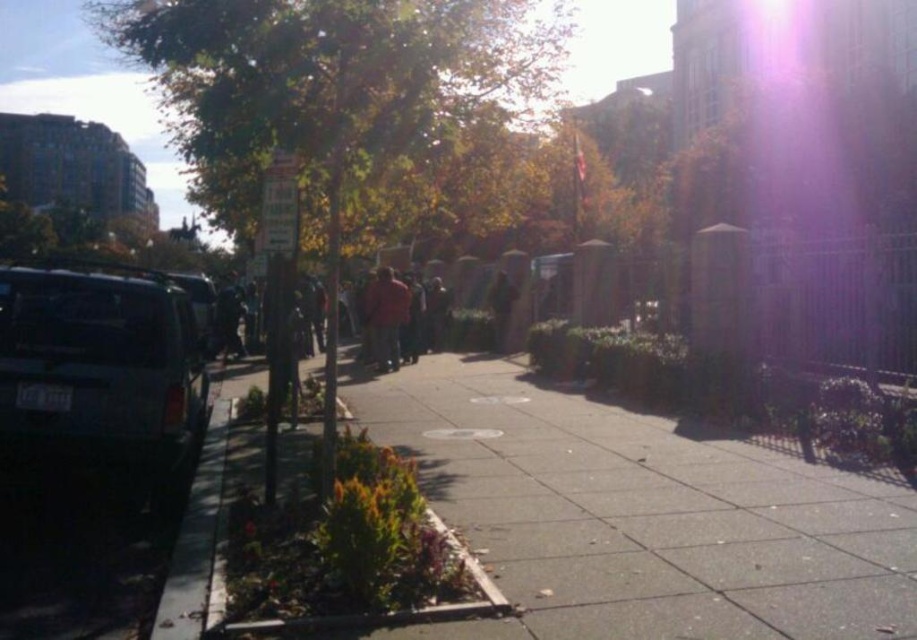
Question: Which object is closer to the camera taking this photo?

Choices:
 (A) black rubber curb at lower left
 (B) green leafy tree at left

Answer: (A)

Question: Which point is farther to the camera?

Choices:
 (A) black rubber curb at lower left
 (B) gray concrete sidewalk at center
 (C) dark gray matte van at left
 (D) matte black suv at left

Answer: (D)

Question: Which of the following is the farthest from the observer?

Choices:
 (A) (199, 321)
 (B) (685, 563)
 (C) (453, 124)
 (D) (396, 364)

Answer: (A)

Question: Is green leafy tree at left below black rubber curb at lower left?

Choices:
 (A) yes
 (B) no

Answer: (B)

Question: Is green leafy tree at left bigger than dark gray matte van at left?

Choices:
 (A) yes
 (B) no

Answer: (A)

Question: Is gray concrete sidewalk at center bigger than red matte jacket at center?

Choices:
 (A) yes
 (B) no

Answer: (A)